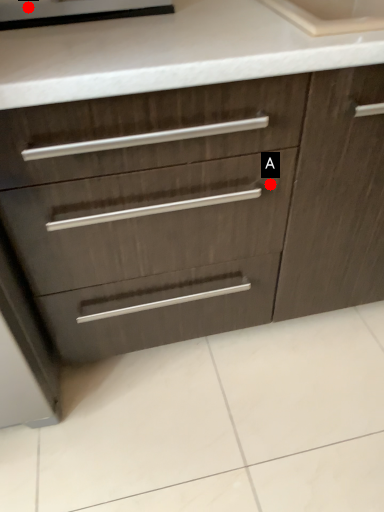
Question: Two points are circled on the image, labeled by A and B beside each circle. Which point is closer to the camera taking this photo?

Choices:
 (A) A is closer
 (B) B is closer

Answer: (B)